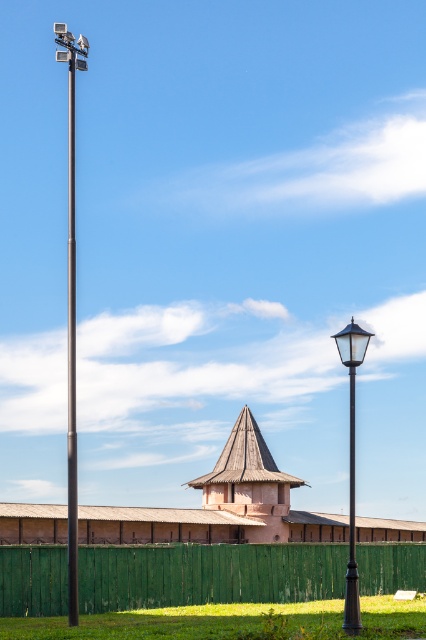
Image resolution: width=426 pixels, height=640 pixels. Describe the element at coordinates (351, 465) in the screenshot. I see `black metal street light at right` at that location.

Is point (353, 616) farther from camera compared to point (351, 612)?

No, (353, 616) is closer to viewer.

Between point (350, 403) and point (350, 605), which one is positioned behind?

Point (350, 403)

Find the location of a particular element. The height and width of the screenshot is (640, 426). black metal street light at right is located at coordinates (351, 465).

Between green wooden fence at lower center and brown clay hut at center, which one appears on the left side from the viewer's perspective?

Positioned to the left is brown clay hut at center.

Does point (187, 592) come closer to viewer compared to point (252, 460)?

Yes.

I want to click on green wooden fence at lower center, so click(207, 573).

Is polished metal pole at center thinner than black metal street light at right?

No, polished metal pole at center is not thinner than black metal street light at right.

In the scene shown: Does polished metal pole at center appear on the right side of black metal street light at right?

No, polished metal pole at center is not to the right of black metal street light at right.

This screenshot has width=426, height=640. Identify the location of polished metal pole at center. (71, 307).